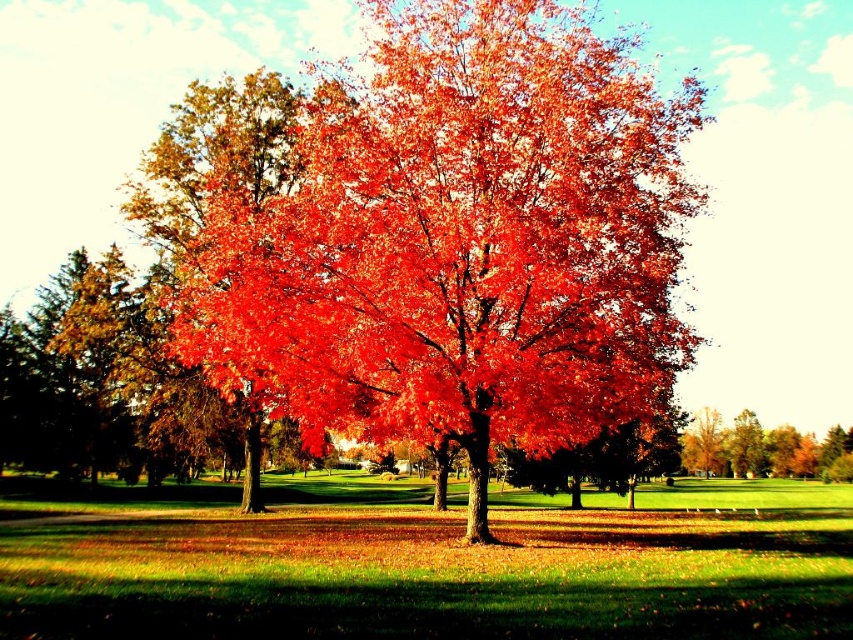
Can you confirm if shiny red maple tree at center is positioned above shiny orange tree at center?

Correct, shiny red maple tree at center is located above shiny orange tree at center.

The height and width of the screenshot is (640, 853). What are the coordinates of `shiny red maple tree at center` in the screenshot? It's located at (460, 241).

Between point (610, 166) and point (749, 435), which one is positioned behind?

Point (749, 435)

Find the location of a particular element. This screenshot has width=853, height=640. shiny red maple tree at center is located at coordinates (460, 241).